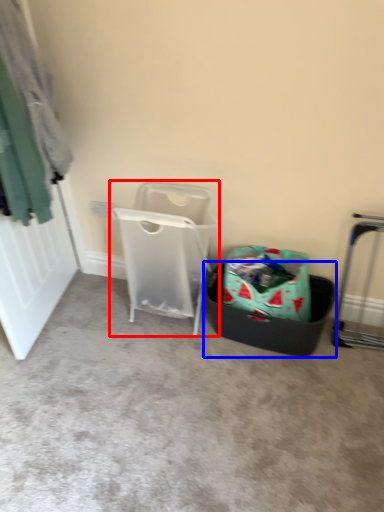
Question: Which point is further to the camera, waste container (highlighted by a red box) or shopping basket (highlighted by a blue box)?

Choices:
 (A) waste container
 (B) shopping basket

Answer: (B)